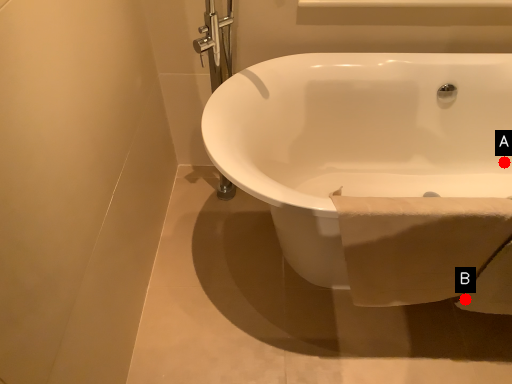
Question: Two points are circled on the image, labeled by A and B beside each circle. Which point is closer to the camera?

Choices:
 (A) A is closer
 (B) B is closer

Answer: (B)